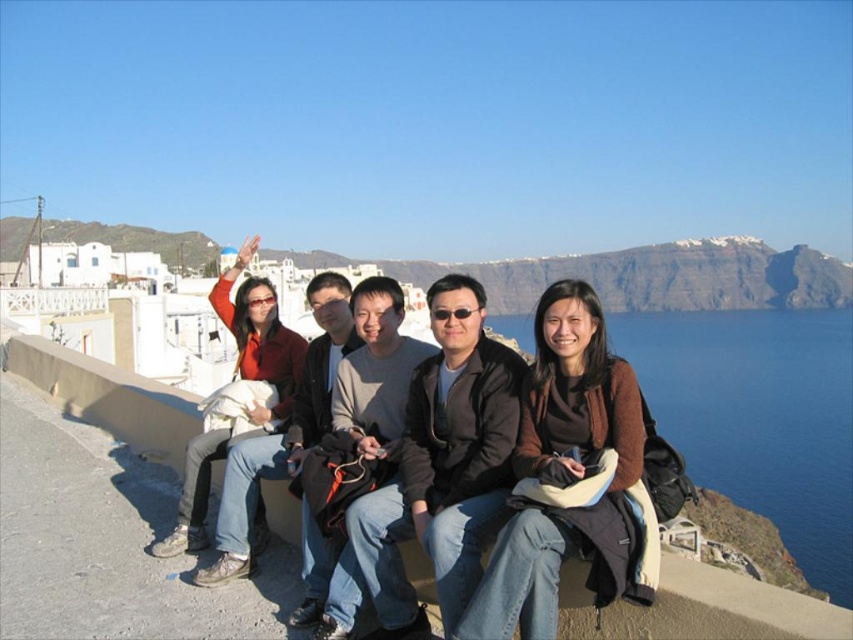
Question: Can you confirm if brown fuzzy sweater at center is wider than matte red jacket at left?

Choices:
 (A) yes
 (B) no

Answer: (B)

Question: Can you confirm if blue water at upper right is smaller than matte red jacket at left?

Choices:
 (A) yes
 (B) no

Answer: (B)

Question: Which point is farther to the camera?

Choices:
 (A) (393, 598)
 (B) (198, 538)

Answer: (B)

Question: Is dark gray jacket at center smaller than matte red jacket at left?

Choices:
 (A) no
 (B) yes

Answer: (B)

Question: Among these points, which one is nearest to the camera?

Choices:
 (A) (653, 413)
 (B) (474, 592)

Answer: (B)

Question: Which object appears closest to the camera in this image?

Choices:
 (A) brown fuzzy sweater at center
 (B) blue water at upper right

Answer: (A)